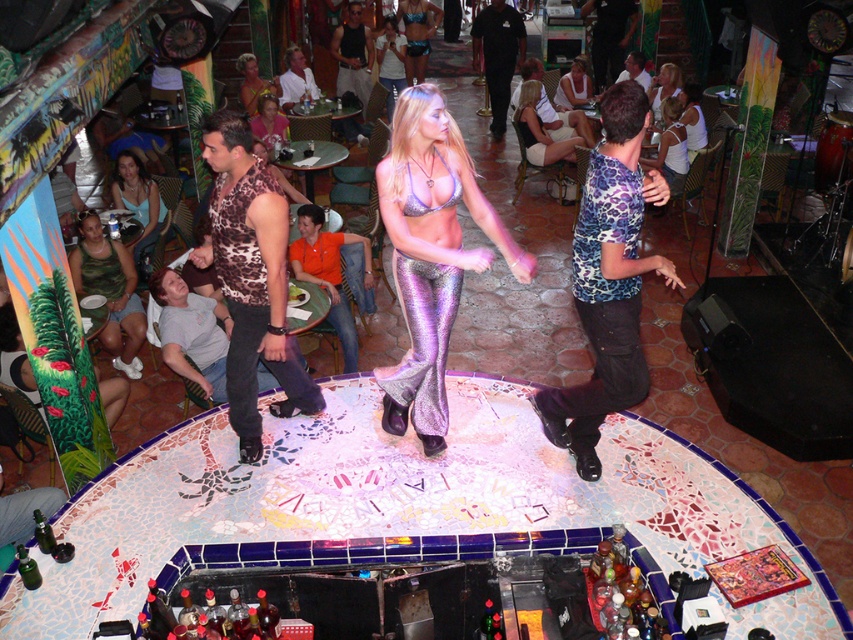
You are a photographer trying to capture the best shot of the nightclub scene. You have two items in your viewfinder, the gray cotton shirt at lower left and the shiny blue bikini at center. Which item appears narrower in your photo?

The gray cotton shirt at lower left is thinner than the shiny blue bikini at center, so the gray cotton shirt at lower left appears narrower in the photo.

You are a photographer at the nightclub. You want to place a small spotlight on the gray cotton shirt at lower left. The spotlight can only be placed at point [192,332]. Is this the correct location?

Yes, the gray cotton shirt at lower left is located at point [192,332], so placing the spotlight there would correctly illuminate it.